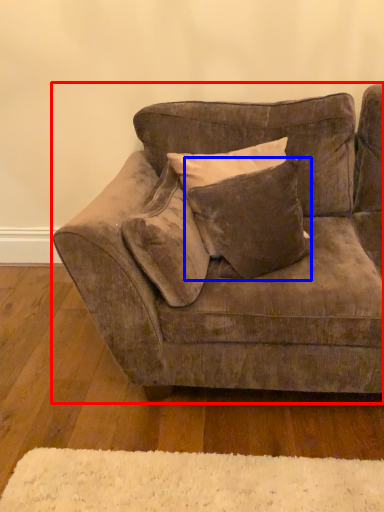
Question: Which of the following is the closest to the observer, studio couch (highlighted by a red box) or pillow (highlighted by a blue box)?

Choices:
 (A) studio couch
 (B) pillow

Answer: (A)